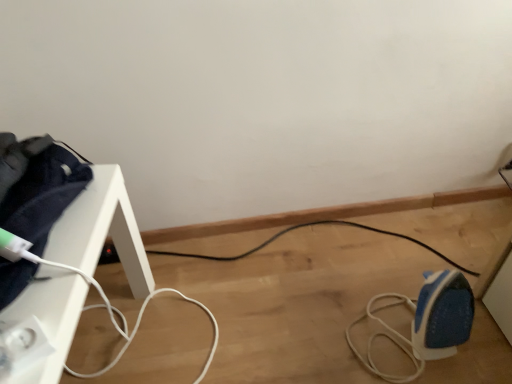
Describe the element at coordinates (102, 230) in the screenshot. The height and width of the screenshot is (384, 512). I see `white plastic table at left` at that location.

Where is `white plastic table at left`? The height and width of the screenshot is (384, 512). white plastic table at left is located at coordinates (102, 230).

Where is `white plastic table at left`? The height and width of the screenshot is (384, 512). white plastic table at left is located at coordinates (102, 230).